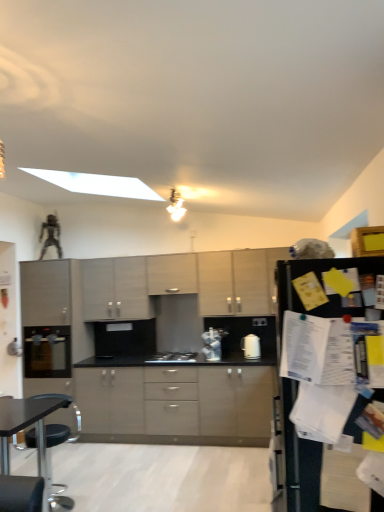
Question: From the image's perspective, is matte gray cabinet at center, the fourth cabinetry positioned from the bottom, under black matte refrigerator at right?

Choices:
 (A) no
 (B) yes

Answer: (A)

Question: Are matte gray cabinet at center, placed as the 1th cabinetry when sorted from top to bottom, and black matte refrigerator at right making contact?

Choices:
 (A) yes
 (B) no

Answer: (B)

Question: Considering the relative sizes of matte gray cabinet at center, the fourth cabinetry positioned from the bottom, and black matte refrigerator at right in the image provided, is matte gray cabinet at center, the fourth cabinetry positioned from the bottom, bigger than black matte refrigerator at right?

Choices:
 (A) yes
 (B) no

Answer: (B)

Question: From the image's perspective, does matte gray cabinet at center, placed as the 1th cabinetry when sorted from top to bottom, appear higher than black matte refrigerator at right?

Choices:
 (A) yes
 (B) no

Answer: (A)

Question: Is matte gray cabinet at center, placed as the 1th cabinetry when sorted from top to bottom, positioned with its back to black matte refrigerator at right?

Choices:
 (A) no
 (B) yes

Answer: (A)

Question: Is matte gray cabinet at center, placed as the 1th cabinetry when sorted from top to bottom, in front of black matte refrigerator at right?

Choices:
 (A) yes
 (B) no

Answer: (B)

Question: Does black matte gas stove at center have a smaller size compared to satin silver toaster at center, the 1th appliance when ordered from front to back?

Choices:
 (A) no
 (B) yes

Answer: (A)

Question: From a real-world perspective, is black matte gas stove at center located higher than satin silver toaster at center, which ranks as the 1th appliance in right-to-left order?

Choices:
 (A) no
 (B) yes

Answer: (A)

Question: Is black matte gas stove at center at the left side of satin silver toaster at center, which ranks as the 1th appliance in right-to-left order?

Choices:
 (A) yes
 (B) no

Answer: (A)

Question: Does black matte gas stove at center come in front of satin silver toaster at center, positioned as the second appliance in left-to-right order?

Choices:
 (A) no
 (B) yes

Answer: (A)

Question: Can you confirm if black matte gas stove at center is wider than satin silver toaster at center, the 1th appliance when ordered from front to back?

Choices:
 (A) yes
 (B) no

Answer: (A)

Question: Is satin silver toaster at center, the 1th appliance when ordered from front to back, at the back of black matte gas stove at center?

Choices:
 (A) no
 (B) yes

Answer: (A)

Question: Considering the relative positions of matte black oven at left, arranged as the 1th appliance when viewed from the left, and matte gray cabinets at center, positioned as the second cabinetry in top-to-bottom order, in the image provided, is matte black oven at left, arranged as the 1th appliance when viewed from the left, to the left of matte gray cabinets at center, positioned as the second cabinetry in top-to-bottom order, from the viewer's perspective?

Choices:
 (A) yes
 (B) no

Answer: (A)